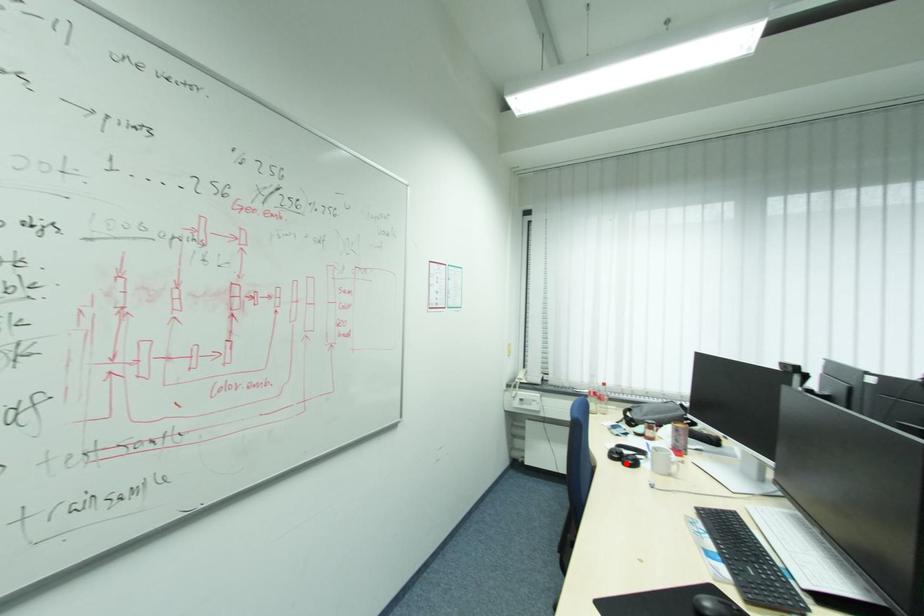
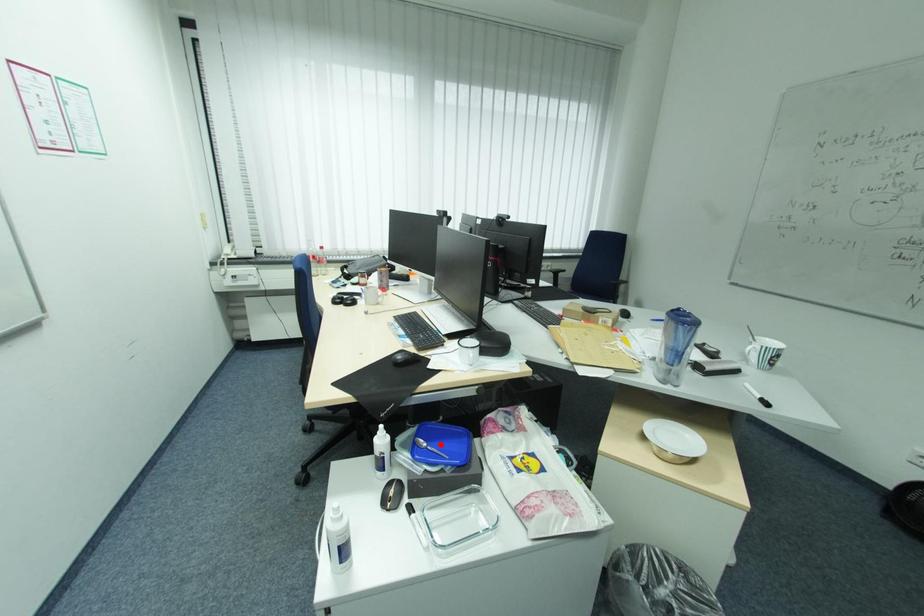
I am providing you with two images of the same scene from different viewpoints. A red point is marked on the first image and another point is marked on the second image. Is the marked point in image1 the same physical position as the marked point in image2?

No